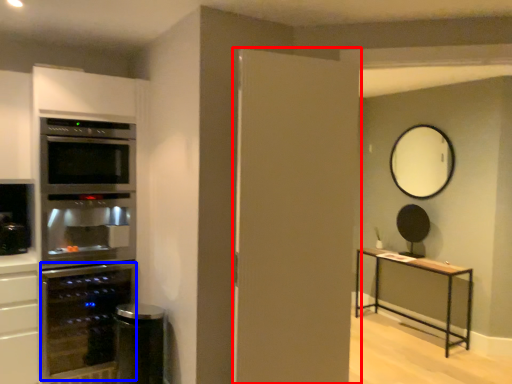
Question: Which of the following is the closest to the observer, door (highlighted by a red box) or appliance (highlighted by a blue box)?

Choices:
 (A) door
 (B) appliance

Answer: (A)